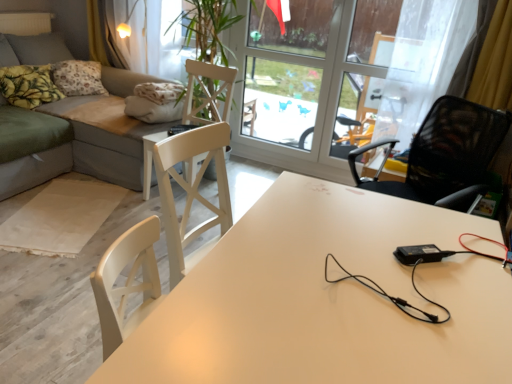
Describe the element at coordinates (91, 139) in the screenshot. The width and height of the screenshot is (512, 384). I see `gray fabric couch at left` at that location.

You are a GUI agent. You are given a task and a screenshot of the screen. Output one action in this format:
    pyautogui.click(x=<x>, y=<y>)
    Task: Click on the transparent glass window at upper center
    The image size is (512, 384).
    Given the screenshot: What is the action you would take?
    pyautogui.click(x=285, y=72)

Describe the element at coordinates (207, 90) in the screenshot. I see `white wood chair at center, the 1th chair viewed from the back` at that location.

What are the coordinates of `yellow printed fabric pillow at upper left, which appears as the second pillow when viewed from the front` in the screenshot? It's located at (78, 78).

What are the coordinates of `gray fabric couch at left` in the screenshot? It's located at (91, 139).

How many degrees apart are the facing directions of yellow printed fabric pillow at upper left, the second pillow when ordered from back to front, and gray fabric couch at left?

The facing directions of yellow printed fabric pillow at upper left, the second pillow when ordered from back to front, and gray fabric couch at left are 5.63 degrees apart.

Is yellow printed fabric pillow at upper left, the second pillow when ordered from back to front, turned away from gray fabric couch at left?

Yes, yellow printed fabric pillow at upper left, the second pillow when ordered from back to front, is facing away from gray fabric couch at left.

Is yellow printed fabric pillow at upper left, which is the first pillow in front-to-back order, shorter than gray fabric couch at left?

Correct, yellow printed fabric pillow at upper left, which is the first pillow in front-to-back order, is not as tall as gray fabric couch at left.

Can gray fabric couch at left be found inside yellow printed fabric pillow at upper left, which is the first pillow in front-to-back order?

No, yellow printed fabric pillow at upper left, which is the first pillow in front-to-back order, does not contain gray fabric couch at left.

Considering their positions, is white glossy table at center located in front of or behind black mesh chair at right, which ranks as the second chair in back-to-front order?

Visually, white glossy table at center is located in front of black mesh chair at right, which ranks as the second chair in back-to-front order.

In terms of width, does white glossy table at center look wider or thinner when compared to black mesh chair at right, which ranks as the second chair in back-to-front order?

Considering their sizes, white glossy table at center looks broader than black mesh chair at right, which ranks as the second chair in back-to-front order.

Is white glossy table at center situated inside black mesh chair at right, which is the 1th chair in right-to-left order, or outside?

white glossy table at center is outside black mesh chair at right, which is the 1th chair in right-to-left order.

Is point (312, 346) closer or farther from the camera than point (488, 116)?

Point (312, 346) is positioned closer to the camera compared to point (488, 116).

Which is closer to the camera, (312,108) or (409,0)?

Positioned in front is point (409,0).

Based on the photo, in terms of width, does transparent glass window at upper center look wider or thinner when compared to transparent glass screen door at upper center?

Considering their sizes, transparent glass window at upper center looks slimmer than transparent glass screen door at upper center.

Considering the sizes of transparent glass window at upper center and transparent glass screen door at upper center in the image, is transparent glass window at upper center bigger or smaller than transparent glass screen door at upper center?

Considering their sizes, transparent glass window at upper center takes up less space than transparent glass screen door at upper center.

Is transparent glass screen door at upper center located within transparent glass window at upper center?

Yes, transparent glass screen door at upper center is a part of transparent glass window at upper center.

Is yellow printed fabric pillow at upper left, which appears as the second pillow when viewed from the front, spatially inside black mesh chair at right, which ranks as the second chair in back-to-front order, or outside of it?

yellow printed fabric pillow at upper left, which appears as the second pillow when viewed from the front, is not enclosed by black mesh chair at right, which ranks as the second chair in back-to-front order.

Is point (88, 61) closer or farther from the camera than point (354, 152)?

Point (88, 61).

Is yellow printed fabric pillow at upper left, which appears as the second pillow when viewed from the front, facing away from black mesh chair at right, arranged as the 2th chair when viewed from the left?

No, black mesh chair at right, arranged as the 2th chair when viewed from the left, is not at the back of yellow printed fabric pillow at upper left, which appears as the second pillow when viewed from the front.

From the image's perspective, does yellow printed fabric pillow at upper left, the first pillow viewed from the back, appear higher than black mesh chair at right, which is the 1th chair in right-to-left order?

Yes, from the image's perspective, yellow printed fabric pillow at upper left, the first pillow viewed from the back, is on top of black mesh chair at right, which is the 1th chair in right-to-left order.

Considering the relative sizes of transparent glass screen door at upper center and yellow printed fabric pillow at upper left, which is the first pillow in front-to-back order, in the image provided, is transparent glass screen door at upper center wider than yellow printed fabric pillow at upper left, which is the first pillow in front-to-back order,?

No.

Which is correct: transparent glass screen door at upper center is inside yellow printed fabric pillow at upper left, which is the first pillow in front-to-back order, or outside of it?

transparent glass screen door at upper center cannot be found inside yellow printed fabric pillow at upper left, which is the first pillow in front-to-back order.

Is transparent glass screen door at upper center looking in the opposite direction of yellow printed fabric pillow at upper left, the second pillow when ordered from back to front?

No, transparent glass screen door at upper center's orientation is not away from yellow printed fabric pillow at upper left, the second pillow when ordered from back to front.

Between transparent glass window at upper center and white glossy table at center, which one appears on the right side from the viewer's perspective?

From the viewer's perspective, white glossy table at center appears more on the right side.

From a real-world perspective, between transparent glass window at upper center and white glossy table at center, who is vertically lower?

In real-world perspective, white glossy table at center is lower.

Considering the points (300, 62) and (227, 334), which point is behind, point (300, 62) or point (227, 334)?

The point (300, 62) is more distant.

Consider the image. From the image's perspective, is transparent glass window at upper center located above or below white glossy table at center?

Clearly, from the image's perspective, transparent glass window at upper center is above white glossy table at center.

Considering the sizes of white wood chair at center, the first chair viewed from the left, and transparent glass window at upper center in the image, is white wood chair at center, the first chair viewed from the left, bigger or smaller than transparent glass window at upper center?

Considering their sizes, white wood chair at center, the first chair viewed from the left, takes up more space than transparent glass window at upper center.

From a real-world perspective, is white wood chair at center, the 1th chair viewed from the back, located beneath transparent glass window at upper center?

Yes, from a real-world perspective, white wood chair at center, the 1th chair viewed from the back, is below transparent glass window at upper center.

Is point (214, 121) closer to camera compared to point (283, 100)?

Yes.

You are a GUI agent. You are given a task and a screenshot of the screen. Output one action in this format:
    pyautogui.click(x=<x>, y=<y>)
    Task: Click on the 1st pillow behind the gray fabric couch at left, counting from the anchor's position
    The image size is (512, 384).
    Given the screenshot: What is the action you would take?
    pyautogui.click(x=28, y=85)

Locate an element on the screen. The height and width of the screenshot is (384, 512). table on the left of black mesh chair at right, positioned as the first chair in front-to-back order is located at coordinates (327, 299).

Considering their positions, is white glossy table at center positioned closer to white wood chair at center, the 1th chair viewed from the back, than gray fabric couch at left?

gray fabric couch at left.

When comparing their distances from white glossy table at center, does gray fabric couch at left or transparent glass screen door at upper center seem closer?

Based on the image, gray fabric couch at left appears to be nearer to white glossy table at center.

When comparing their distances from black mesh chair at right, which ranks as the second chair in back-to-front order, does white wood chair at center, the 1th chair viewed from the back, or yellow printed fabric pillow at upper left, the second pillow when ordered from back to front, seem further?

yellow printed fabric pillow at upper left, the second pillow when ordered from back to front, lies further to black mesh chair at right, which ranks as the second chair in back-to-front order, than the other object.

Based on their spatial positions, is black mesh chair at right, positioned as the first chair in front-to-back order, or transparent glass screen door at upper center closer to gray fabric couch at left?

transparent glass screen door at upper center is closer to gray fabric couch at left.

Based on their spatial positions, is transparent glass screen door at upper center or transparent glass window at upper center closer to white glossy table at center?

Based on the image, transparent glass screen door at upper center appears to be nearer to white glossy table at center.

Considering their positions, is white wood chair at center, the first chair viewed from the left, positioned further to transparent glass window at upper center than yellow printed fabric pillow at upper left, the first pillow viewed from the back?

yellow printed fabric pillow at upper left, the first pillow viewed from the back, is further to transparent glass window at upper center.

Considering their positions, is yellow printed fabric pillow at upper left, the first pillow viewed from the back, positioned closer to white glossy table at center than black mesh chair at right, which ranks as the second chair in back-to-front order?

black mesh chair at right, which ranks as the second chair in back-to-front order, is positioned closer to the anchor white glossy table at center.

Looking at the image, which one is located further to gray fabric couch at left, transparent glass window at upper center or white wood chair at center, the first chair viewed from the left?

transparent glass window at upper center is further to gray fabric couch at left.

This screenshot has height=384, width=512. In order to click on window screen between transparent glass screen door at upper center and white wood chair at center, the first chair viewed from the left, vertically in this screenshot , I will do `click(285, 72)`.

Locate an element on the screen. The image size is (512, 384). chair between gray fabric couch at left and black mesh chair at right, which is the 1th chair in right-to-left order is located at coordinates click(207, 90).

Identify the location of pillow between yellow printed fabric pillow at upper left, which is the first pillow in front-to-back order, and white wood chair at center, marked as the second chair in a front-to-back arrangement, in the horizontal direction. (78, 78).

This screenshot has height=384, width=512. I want to click on screen door between yellow printed fabric pillow at upper left, the first pillow viewed from the back, and black mesh chair at right, positioned as the first chair in front-to-back order, from left to right, so click(x=345, y=75).